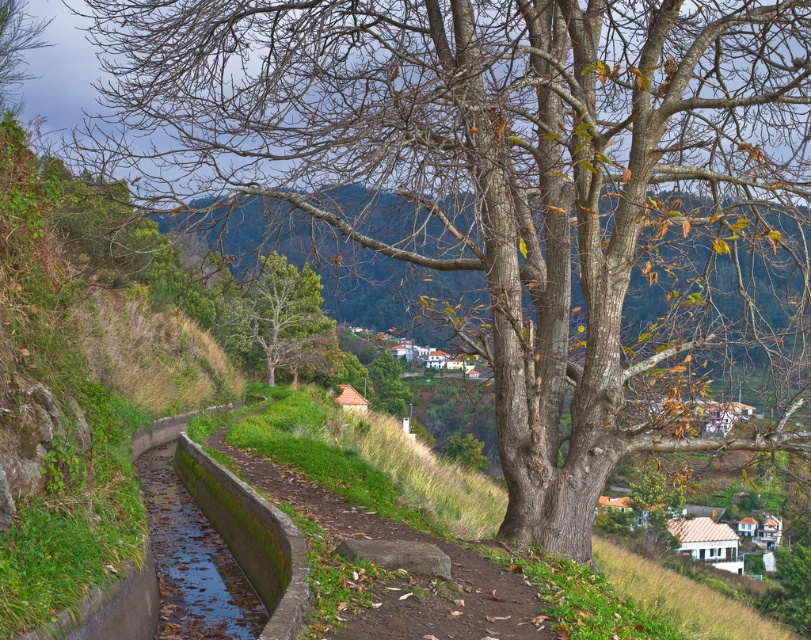
Which is behind, point (251, 301) or point (5, 90)?

The point (251, 301) is behind.

Is green leafy tree at center closer to camera compared to brown matte tree at upper left?

Yes, it is.

Is point (320, 292) more distant than point (16, 49)?

Yes, it is behind point (16, 49).

The width and height of the screenshot is (811, 640). I want to click on green leafy tree at center, so click(x=284, y=317).

Is point (252, 493) positioned after point (0, 19)?

No, (252, 493) is closer to viewer.

Looking at this image, can you confirm if green mossy concrete at center is taller than brown matte tree at upper left?

Yes, green mossy concrete at center is taller than brown matte tree at upper left.

The height and width of the screenshot is (640, 811). Describe the element at coordinates (204, 554) in the screenshot. I see `green mossy concrete at center` at that location.

At what (x,y) coordinates should I click in order to perform the action: click on green mossy concrete at center. Please return your answer as a coordinate pair (x, y). The height and width of the screenshot is (640, 811). Looking at the image, I should click on (204, 554).

Between green mossy concrete at center and green leafy tree at center, which one has less height?

green mossy concrete at center

Can you confirm if green mossy concrete at center is positioned to the left of green leafy tree at center?

No, green mossy concrete at center is not to the left of green leafy tree at center.

Image resolution: width=811 pixels, height=640 pixels. Find the location of `green mossy concrete at center`. green mossy concrete at center is located at coordinates (204, 554).